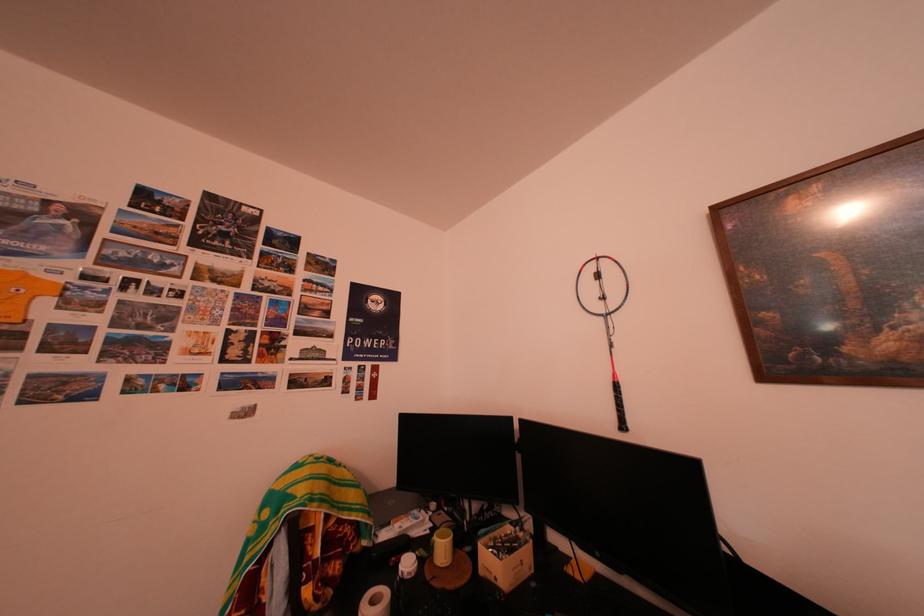
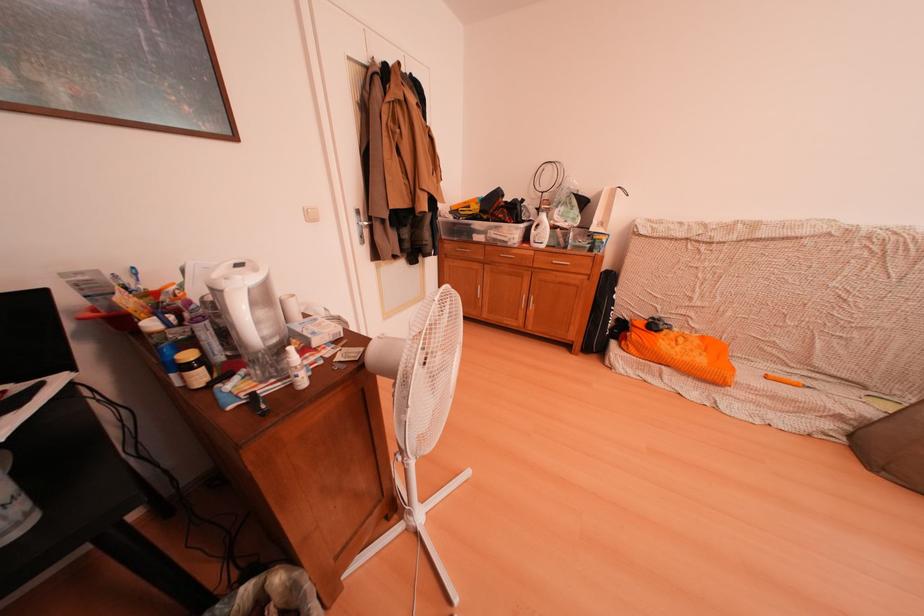
The images are taken continuously from a first-person perspective. In which direction is your viewpoint rotating?

The camera rotated toward right-down.